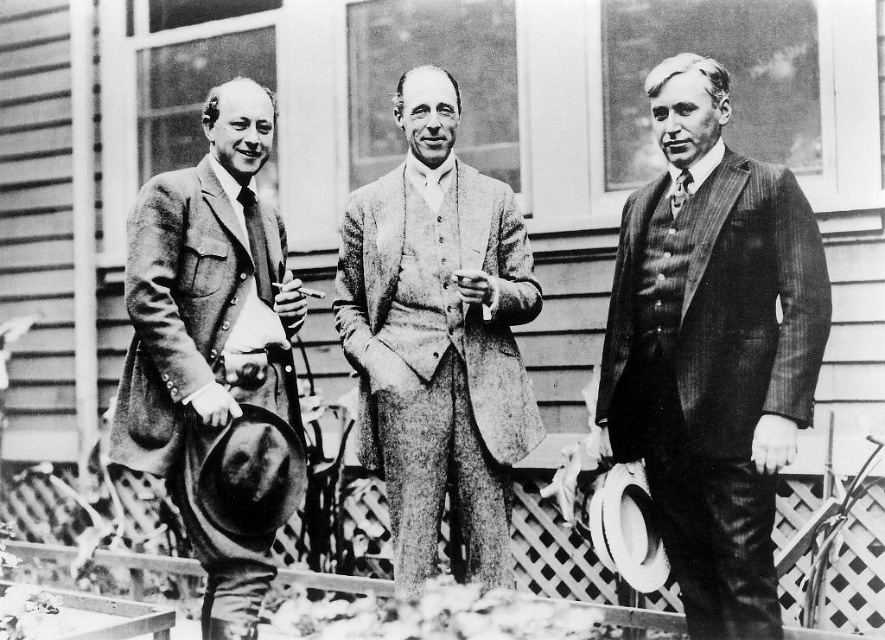
Question: Is matte brown suit at center above black silk tie at center?

Choices:
 (A) no
 (B) yes

Answer: (A)

Question: In this image, where is matte black tie at center located relative to black silk tie at center?

Choices:
 (A) below
 (B) above

Answer: (A)

Question: Which point is closer to the camera taking this photo?

Choices:
 (A) (676, 184)
 (B) (520, 273)
 (C) (737, 384)
 (D) (152, 336)

Answer: (C)

Question: Can you confirm if striped wool suit at center is smaller than black silk tie at center?

Choices:
 (A) yes
 (B) no

Answer: (B)

Question: Which object appears closest to the camera in this image?

Choices:
 (A) black silk tie at center
 (B) matte black tie at center
 (C) striped wool suit at center
 (D) matte brown suit at center

Answer: (C)

Question: Based on their relative distances, which object is farther from the black silk tie at center?

Choices:
 (A) matte black tie at center
 (B) textured wool suit at center
 (C) striped wool suit at center

Answer: (A)